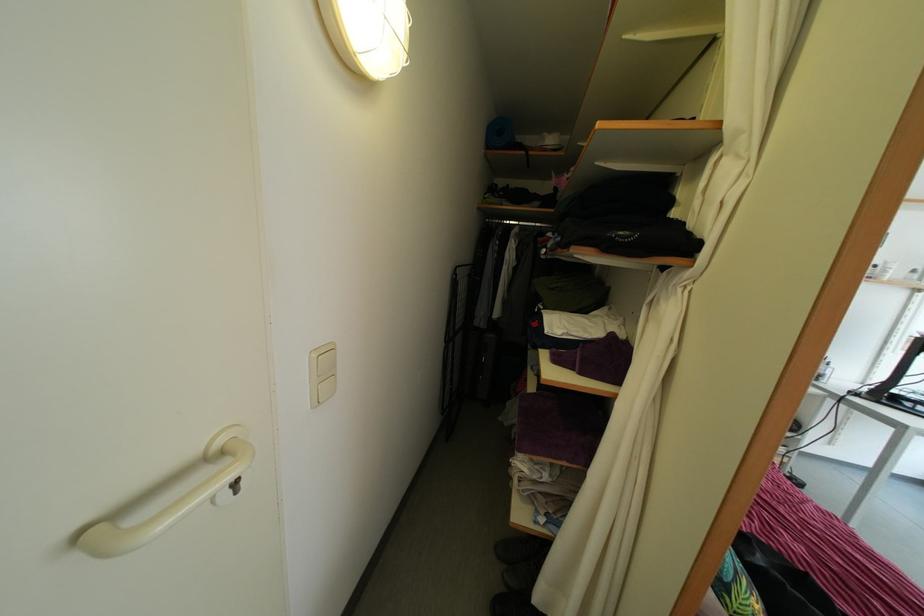
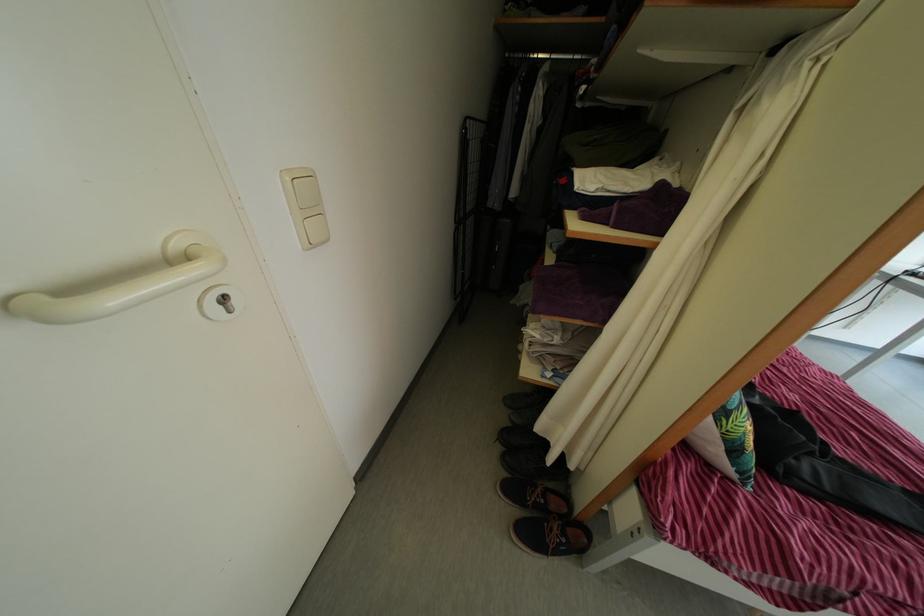
Locate, in the second image, the point that corresponds to (538,395) in the first image.

(556, 267)